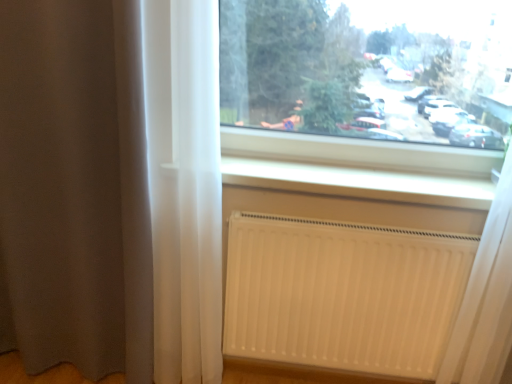
Question: Is white matte radiator at lower right to the left of transparent glass window at upper center from the viewer's perspective?

Choices:
 (A) no
 (B) yes

Answer: (B)

Question: Considering the relative positions of white matte radiator at lower right and transparent glass window at upper center in the image provided, is white matte radiator at lower right in front of transparent glass window at upper center?

Choices:
 (A) no
 (B) yes

Answer: (A)

Question: Is white matte radiator at lower right facing away from transparent glass window at upper center?

Choices:
 (A) yes
 (B) no

Answer: (B)

Question: Considering the relative sizes of white matte radiator at lower right and transparent glass window at upper center in the image provided, is white matte radiator at lower right wider than transparent glass window at upper center?

Choices:
 (A) no
 (B) yes

Answer: (A)

Question: Is white matte radiator at lower right surrounding transparent glass window at upper center?

Choices:
 (A) yes
 (B) no

Answer: (B)

Question: In the image, is white matte radiator at lower right on the left side or the right side of white smooth radiator at lower center?

Choices:
 (A) left
 (B) right

Answer: (A)

Question: Does point (442, 281) appear closer or farther from the camera than point (257, 173)?

Choices:
 (A) farther
 (B) closer

Answer: (B)

Question: Is white matte radiator at lower right inside or outside of white smooth radiator at lower center?

Choices:
 (A) inside
 (B) outside

Answer: (B)

Question: From the image's perspective, relative to white smooth radiator at lower center, is white matte radiator at lower right above or below?

Choices:
 (A) above
 (B) below

Answer: (B)

Question: Is point (26, 130) positioned closer to the camera than point (290, 89)?

Choices:
 (A) closer
 (B) farther

Answer: (A)

Question: From the image's perspective, is brown sheer curtain at left positioned above or below transparent glass window at upper center?

Choices:
 (A) below
 (B) above

Answer: (A)

Question: Do you think brown sheer curtain at left is within transparent glass window at upper center, or outside of it?

Choices:
 (A) inside
 (B) outside

Answer: (B)

Question: Would you say brown sheer curtain at left is to the left or to the right of transparent glass window at upper center in the picture?

Choices:
 (A) left
 (B) right

Answer: (A)

Question: From the image's perspective, is transparent glass window at upper center above or below white smooth radiator at lower center?

Choices:
 (A) below
 (B) above

Answer: (B)

Question: Is transparent glass window at upper center bigger or smaller than white smooth radiator at lower center?

Choices:
 (A) small
 (B) big

Answer: (B)